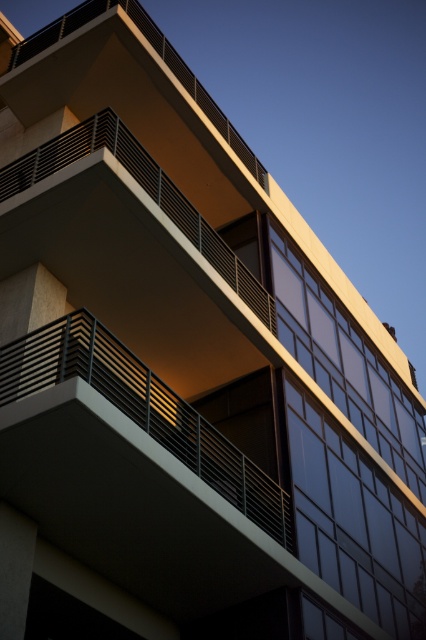
You are standing at the point labeled point (98,362). You want to throw a ball to your friend who is standing at the other point. If the maximum distance you can throw is 25 meters, will you be able to reach them?

The points are 24.98 meters apart. Since your maximum throw is 25 meters, you can just barely reach them.

You are an architect reviewing the building design. You notice the metallic railings at center and the matte black railing at upper center. Which one is located lower in the building structure?

The metallic railings at center are positioned under the matte black railing at upper center, so the metallic railings at center is lower in the building structure.